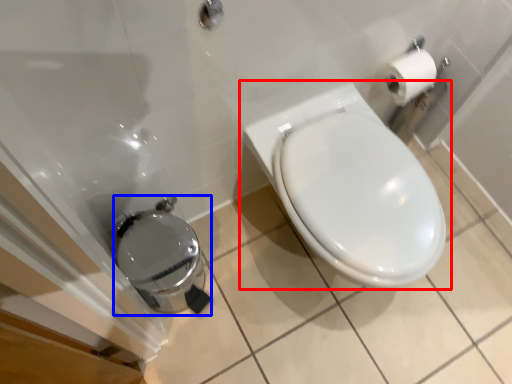
Question: Which of the following is the closest to the observer, toilet (highlighted by a red box) or porcelain (highlighted by a blue box)?

Choices:
 (A) toilet
 (B) porcelain

Answer: (A)